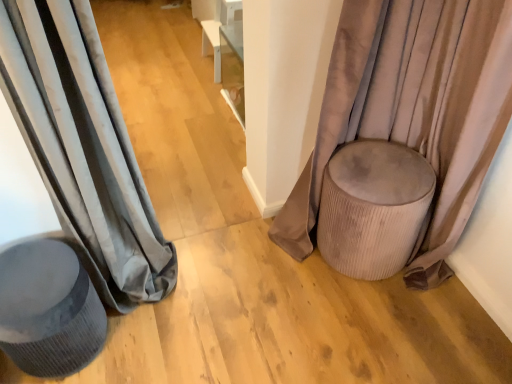
Question: Is velvet beige pouf at right, the 2th curtain viewed from the left, surrounding matte gray curtain at left, the 2th curtain positioned from the right?

Choices:
 (A) no
 (B) yes

Answer: (A)

Question: Is velvet beige pouf at right, the 1th curtain positioned from the right, facing towards matte gray curtain at left, the 2th curtain positioned from the right?

Choices:
 (A) yes
 (B) no

Answer: (B)

Question: Can you confirm if velvet beige pouf at right, the 1th curtain positioned from the right, is thinner than matte gray curtain at left, the 1th curtain viewed from the left?

Choices:
 (A) yes
 (B) no

Answer: (A)

Question: Can you confirm if velvet beige pouf at right, the 1th curtain positioned from the right, is positioned to the left of matte gray curtain at left, the 1th curtain viewed from the left?

Choices:
 (A) yes
 (B) no

Answer: (B)

Question: Is velvet beige pouf at right, the 2th curtain viewed from the left, outside matte gray curtain at left, the 2th curtain positioned from the right?

Choices:
 (A) no
 (B) yes

Answer: (B)

Question: Is the position of velvet beige pouf at right, the 1th curtain positioned from the right, less distant than that of matte gray curtain at left, the 2th curtain positioned from the right?

Choices:
 (A) no
 (B) yes

Answer: (A)

Question: Is velvet beige pouf at right, the 2th curtain viewed from the left, positioned with its back to matte gray stool at left?

Choices:
 (A) no
 (B) yes

Answer: (A)

Question: Can matte gray stool at left be found inside velvet beige pouf at right, the 1th curtain positioned from the right?

Choices:
 (A) yes
 (B) no

Answer: (B)

Question: Is velvet beige pouf at right, the 1th curtain positioned from the right, thinner than matte gray stool at left?

Choices:
 (A) no
 (B) yes

Answer: (B)

Question: Does velvet beige pouf at right, the 2th curtain viewed from the left, lie in front of matte gray stool at left?

Choices:
 (A) no
 (B) yes

Answer: (B)

Question: Can you confirm if velvet beige pouf at right, the 1th curtain positioned from the right, is bigger than matte gray stool at left?

Choices:
 (A) yes
 (B) no

Answer: (A)

Question: From the image's perspective, is velvet beige pouf at right, the 2th curtain viewed from the left, on top of matte gray stool at left?

Choices:
 (A) no
 (B) yes

Answer: (B)

Question: Is the surface of velvet beige pouf at right, the 2th curtain viewed from the left, in direct contact with suede beige ottoman at right?

Choices:
 (A) yes
 (B) no

Answer: (B)